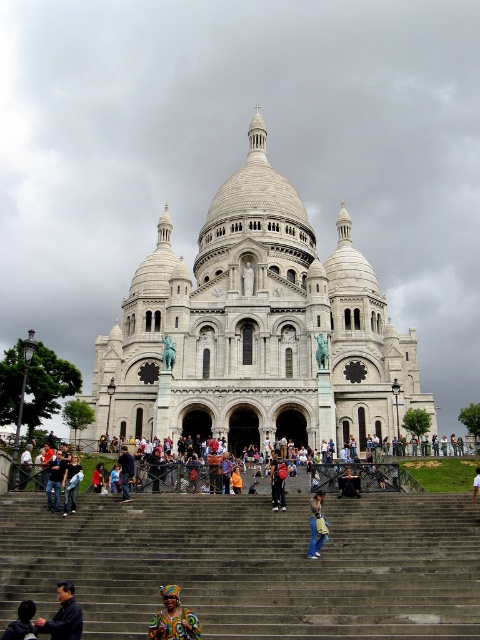
You are a photographer standing at the bottom of the staircase leading to the Sacre Coeur Basilica. You see a person wearing a dark blue shirt at lower left and another wearing a denim jacket at lower center. If you want to take a photo that includes both individuals, which direction should you move to ensure both are in frame?

You should move to the right so that both the dark blue shirt at lower left and the denim jacket at lower center are included in the frame. Since the dark blue shirt at lower left is positioned to the left of the denim jacket at lower center, moving right will widen your angle to capture both.

You are a photographer planning to take a group photo of the dark blue shirt at lower left and the denim jacket at lower center in front of the Sacre Coeur Basilica. Based on their positions, which person should stand closer to the camera to ensure both are in focus?

The dark blue shirt at lower left should stand closer to the camera because it is shorter than the denim jacket at lower center, ensuring both will be in focus.

In the scene shown: You are a tour guide standing at the top of the staircase leading to the Basilica of the Sacred Heart of Paris. You notice a tourist wearing a dark blue shirt at lower left and another wearing a denim jacket at lower center. If you want to greet both tourists, which one would you need to walk further towards to reach first?

The dark blue shirt at lower left is 16.34 meters away from the denim jacket at lower center. Since you are at the top of the staircase, you would need to walk further towards the dark blue shirt at lower left to reach it first because it is farther away than the denim jacket at lower center.